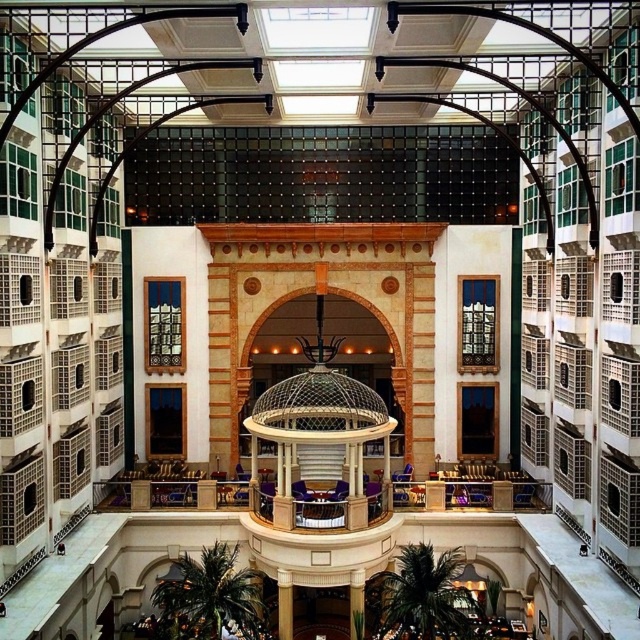
Between golden polished column at center and green marble pillar at center, which one is positioned lower?

golden polished column at center

Between point (278, 621) and point (353, 570), which one is positioned behind?

The point (278, 621) is more distant.

Where is `golden polished column at center`? golden polished column at center is located at coordinates (284, 604).